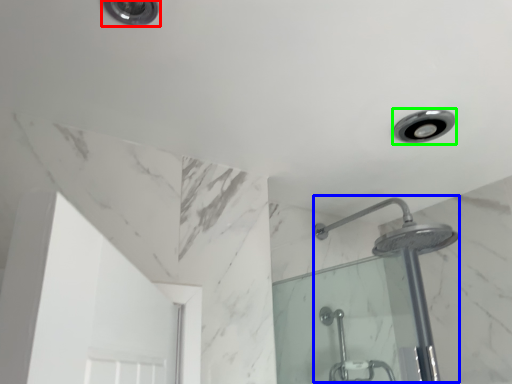
Question: Based on their relative distances, which object is nearer to light fixture (highlighted by a red box)? Choose from shower (highlighted by a blue box) and light fixture (highlighted by a green box).

Choices:
 (A) shower
 (B) light fixture

Answer: (B)